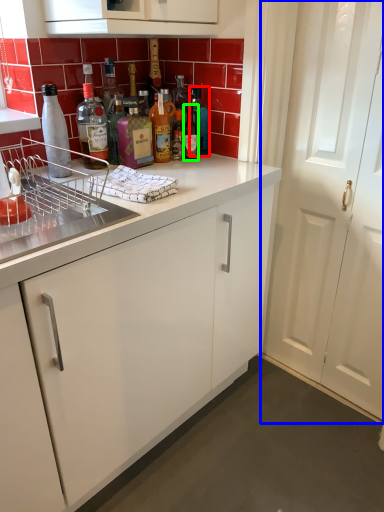
Question: Which object is positioned closest to bottle (highlighted by a red box)? Select from door (highlighted by a blue box) and bottle (highlighted by a green box).

Choices:
 (A) door
 (B) bottle

Answer: (B)